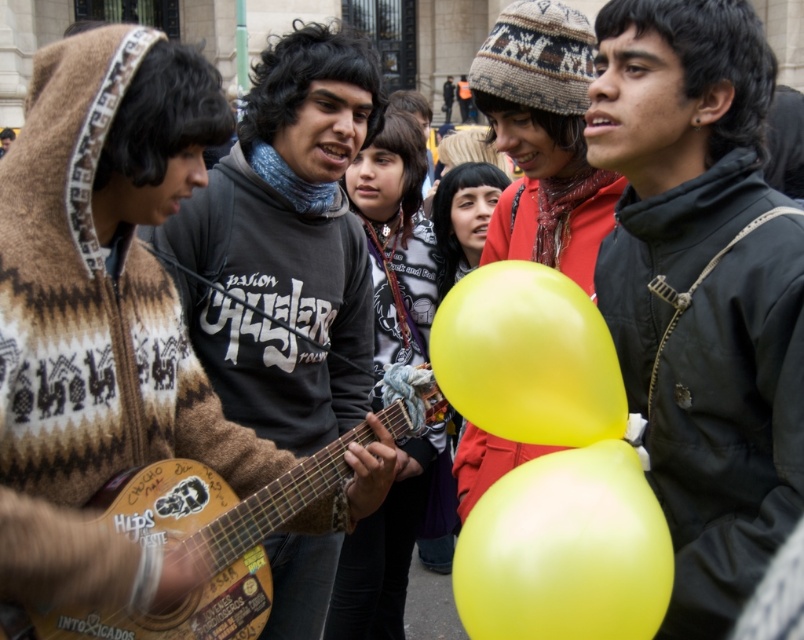
You are a photographer standing in front of the knitted wool sweater at center and the wooden acoustic guitar at left. Which object is closer to you?

The knitted wool sweater at center is closer to you because it is positioned further to the viewer than the wooden acoustic guitar at left.

You are a photographer standing at the edge of the street scene. You want to take a photo that includes both the knitted wool sweater at center and the yellow rubber balloon at center. What is the minimum distance you need to move backward to ensure both objects are in frame?

The knitted wool sweater at center and yellow rubber balloon at center are 11.75 meters apart from each other. To include both in the photo, you need to move back at least half of that distance, so approximately 5.875 meters, to ensure both are within the camera frame.

You are an artist trying to sketch this scene. You notice the knitted wool sweater at center and the yellow rubber balloon at center. Which object should you draw first if you want to focus on the larger one?

The knitted wool sweater at center has a larger size compared to the yellow rubber balloon at center, so you should draw the knitted wool sweater at center first.